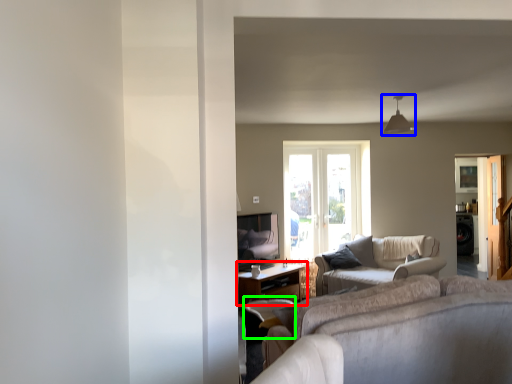
Question: Considering the real-world distances, which object is farthest from table (highlighted by a red box)? light fixture (highlighted by a blue box) or swivel chair (highlighted by a green box)?

Choices:
 (A) light fixture
 (B) swivel chair

Answer: (A)